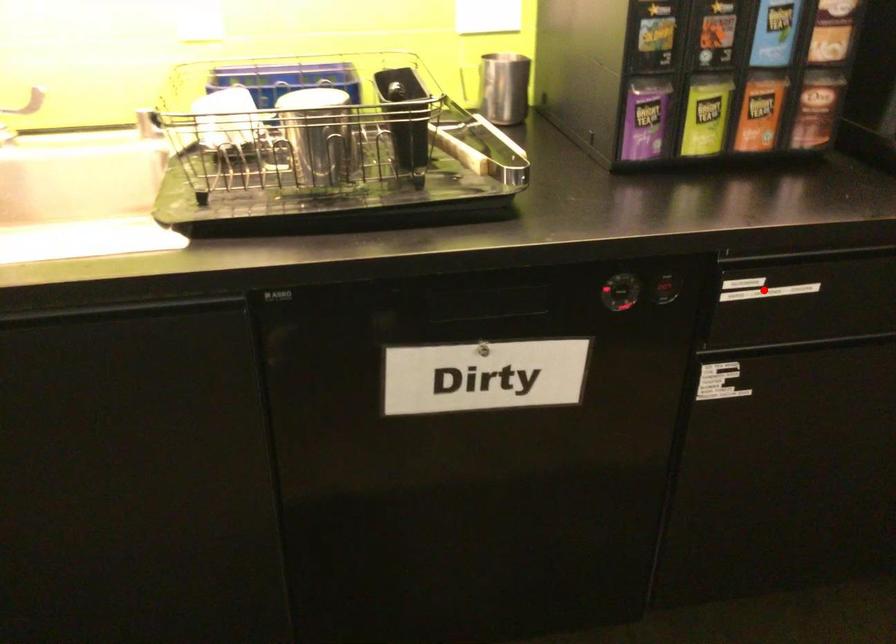
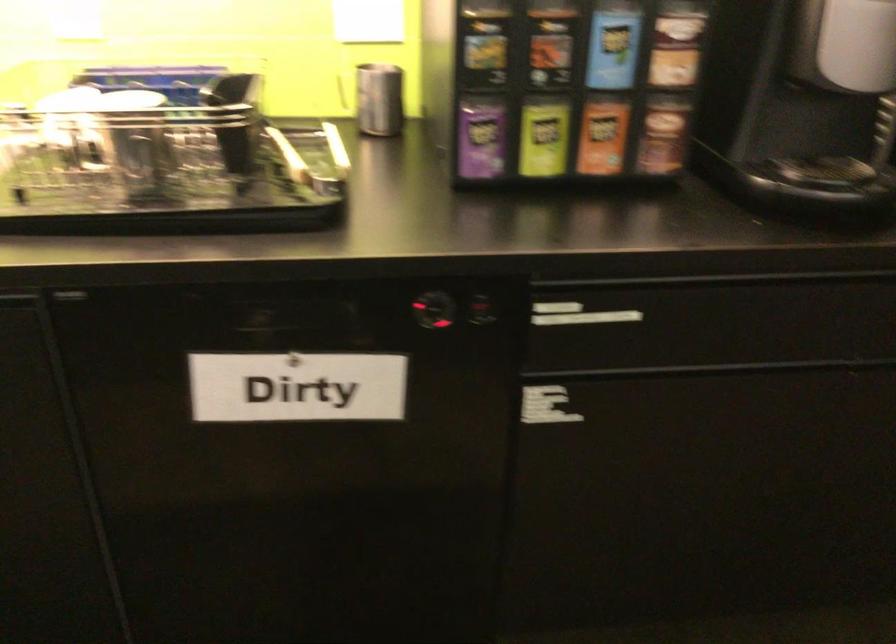
Find the pixel in the second image that matches the highlighted location in the first image.

(578, 315)